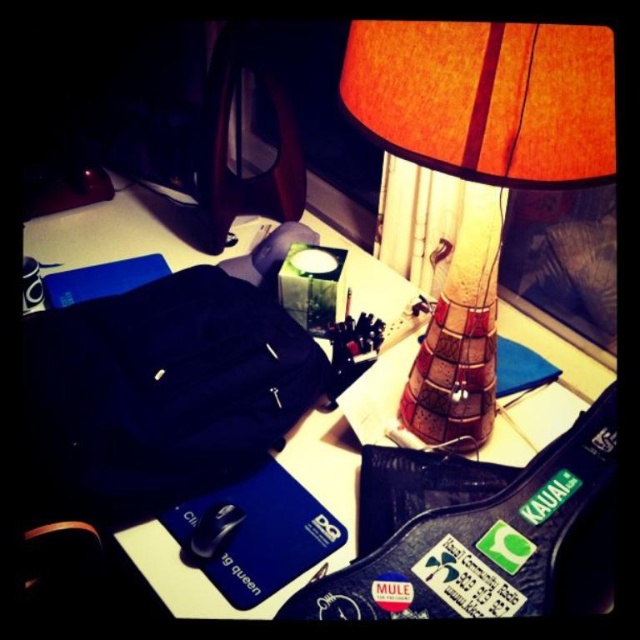
You are organizing items on the desk. You need to place a new item at the center of the desk. However, there is already an object at point (164, 387). What is the object at that point?

The object at point (164, 387) is the matte black backpack at center.

You are organizing items on the desk and need to place a tall plant between the orange fabric lampshade at upper right and the matte black backpack at center. Considering their heights, which object should the plant be placed closer to?

The orange fabric lampshade at upper right is much taller than the matte black backpack at center, so the plant should be placed closer to the matte black backpack at center to balance the height difference.

You are a person sitting at the desk in the image. You want to reach for an object located at point (x=452, y=449) and another at point (x=577, y=349). Which point is closer to you?

Point (x=452, y=449) is in front of point (x=577, y=349), so it is closer to you.